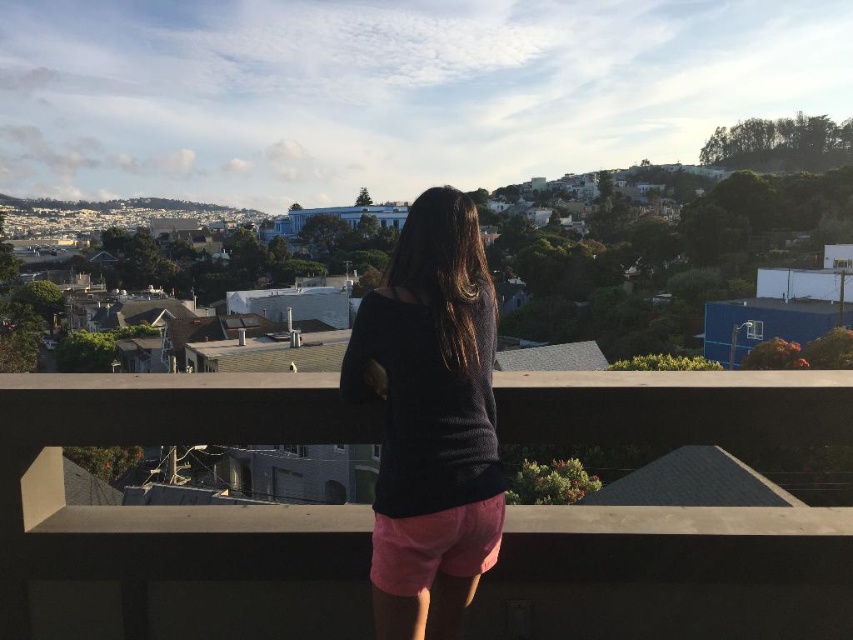
Question: Is the position of concrete at center less distant than that of dark gray sweater at center?

Choices:
 (A) no
 (B) yes

Answer: (B)

Question: Among these objects, which one is farthest from the camera?

Choices:
 (A) dark gray sweater at center
 (B) concrete at center

Answer: (A)

Question: Can you confirm if concrete at center is bigger than dark gray sweater at center?

Choices:
 (A) no
 (B) yes

Answer: (B)

Question: Does concrete at center appear on the right side of dark gray sweater at center?

Choices:
 (A) no
 (B) yes

Answer: (A)